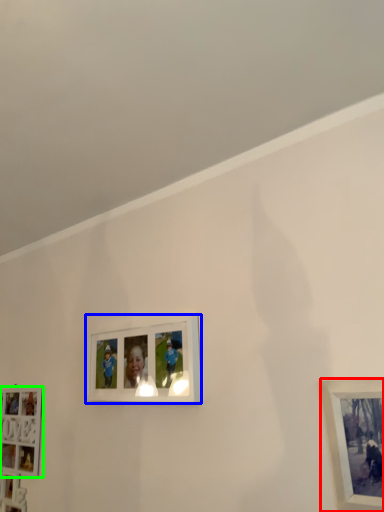
Question: Estimate the real-world distances between objects in this image. Which object is farther from picture frame (highlighted by a red box), picture frame (highlighted by a blue box) or picture frame (highlighted by a green box)?

Choices:
 (A) picture frame
 (B) picture frame

Answer: (B)